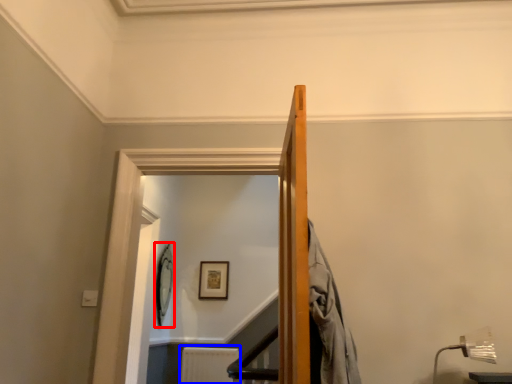
Question: Which of the following is the closest to the observer, picture frame (highlighted by a red box) or radiator (highlighted by a blue box)?

Choices:
 (A) picture frame
 (B) radiator

Answer: (A)